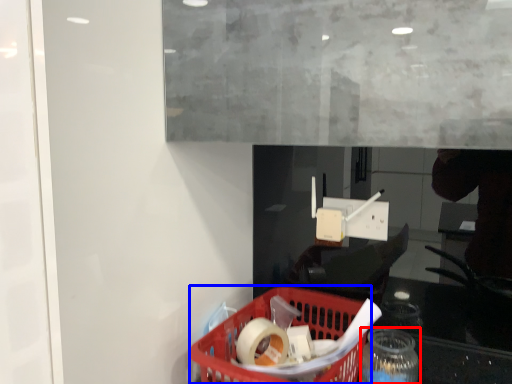
Question: Which object appears closest to the camera in this image, bottle (highlighted by a red box) or basket (highlighted by a blue box)?

Choices:
 (A) bottle
 (B) basket

Answer: (B)